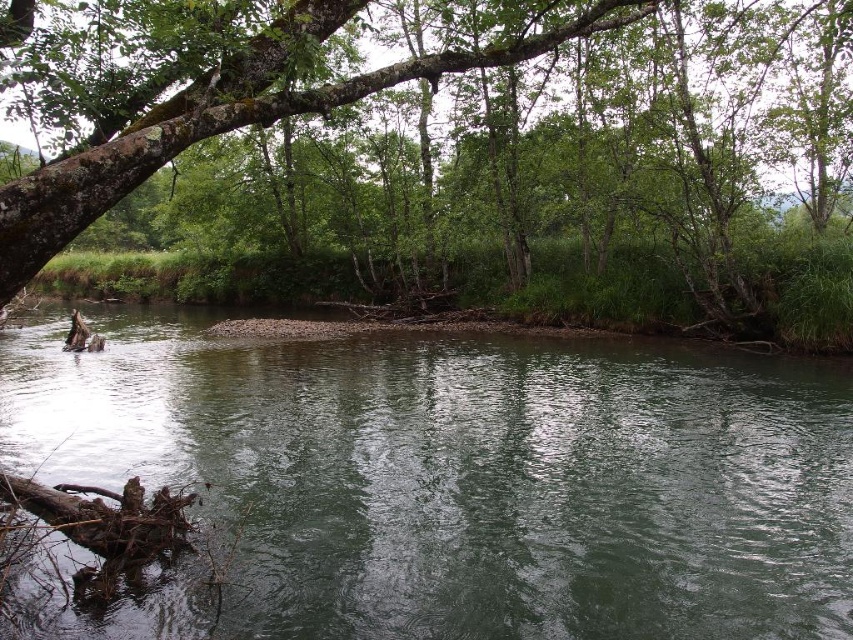
Which is more to the left, green rough bark tree at upper left or green smooth water at center?

green rough bark tree at upper left is more to the left.

Can you confirm if green rough bark tree at upper left is taller than green smooth water at center?

Yes.

This screenshot has height=640, width=853. Identify the location of green rough bark tree at upper left. (456, 147).

The height and width of the screenshot is (640, 853). What are the coordinates of `green rough bark tree at upper left` in the screenshot? It's located at (456, 147).